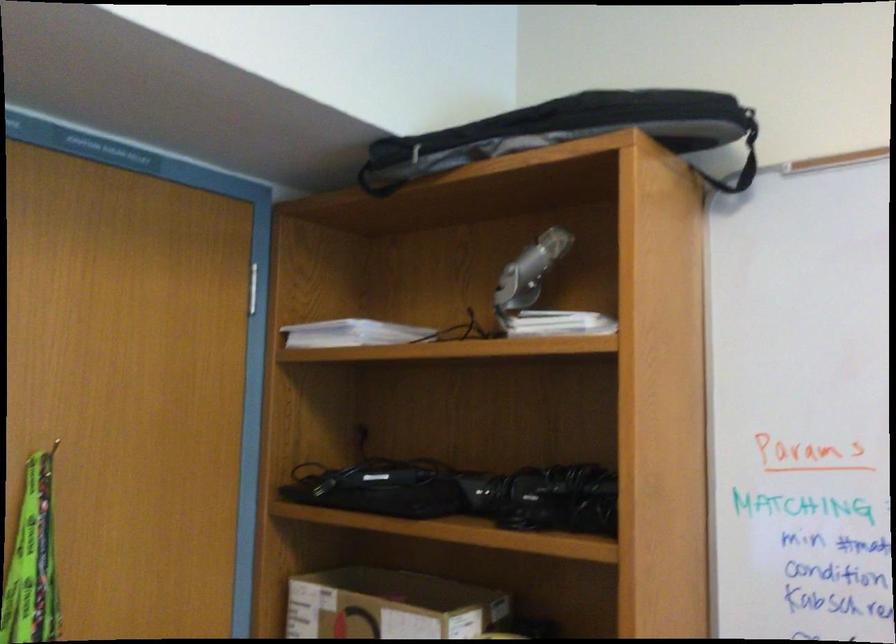
You are a GUI agent. You are given a task and a screenshot of the screen. Output one action in this format:
    pyautogui.click(x=<x>, y=<y>)
    Task: Click on the cardboard box
    The height and width of the screenshot is (644, 896).
    Given the screenshot: What is the action you would take?
    pyautogui.click(x=389, y=605)